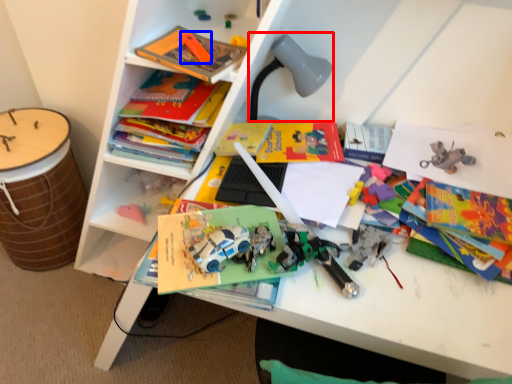
Question: Which object is closer to the camera taking this photo, lamp (highlighted by a red box) or toy (highlighted by a blue box)?

Choices:
 (A) lamp
 (B) toy

Answer: (B)